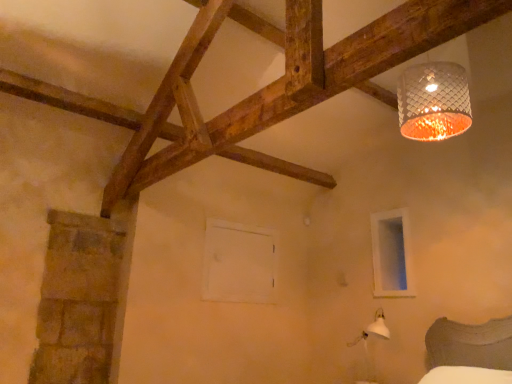
Question: In the image, is white matte window frame at center, which ranks as the 1th window frame in left-to-right order, positioned in front of or behind white matte window frame at lower right, which appears as the 1th window frame when viewed from the right?

Choices:
 (A) behind
 (B) front

Answer: (A)

Question: Is white matte window frame at center, which ranks as the 1th window frame in left-to-right order, taller or shorter than white matte window frame at lower right, which appears as the 1th window frame when viewed from the right?

Choices:
 (A) short
 (B) tall

Answer: (A)

Question: Visually, is white matte window frame at center, which ranks as the 1th window frame in left-to-right order, positioned to the left or to the right of white matte window frame at lower right, which appears as the 1th window frame when viewed from the right?

Choices:
 (A) left
 (B) right

Answer: (A)

Question: Is white matte window frame at lower right, which appears as the 1th window frame when viewed from the right, in front of or behind white matte window frame at center, the second window frame from the right, in the image?

Choices:
 (A) behind
 (B) front

Answer: (B)

Question: From the image's perspective, relative to white matte window frame at center, the second window frame from the right, is white matte window frame at lower right, which appears as the 1th window frame when viewed from the right, above or below?

Choices:
 (A) above
 (B) below

Answer: (A)

Question: In terms of height, does white matte window frame at lower right, which appears as the 1th window frame when viewed from the right, look taller or shorter compared to white matte window frame at center, which ranks as the 1th window frame in left-to-right order?

Choices:
 (A) short
 (B) tall

Answer: (B)

Question: From a real-world perspective, is white matte window frame at lower right, which is the second window frame from left to right, positioned above or below white matte window frame at center, the second window frame from the right?

Choices:
 (A) above
 (B) below

Answer: (A)